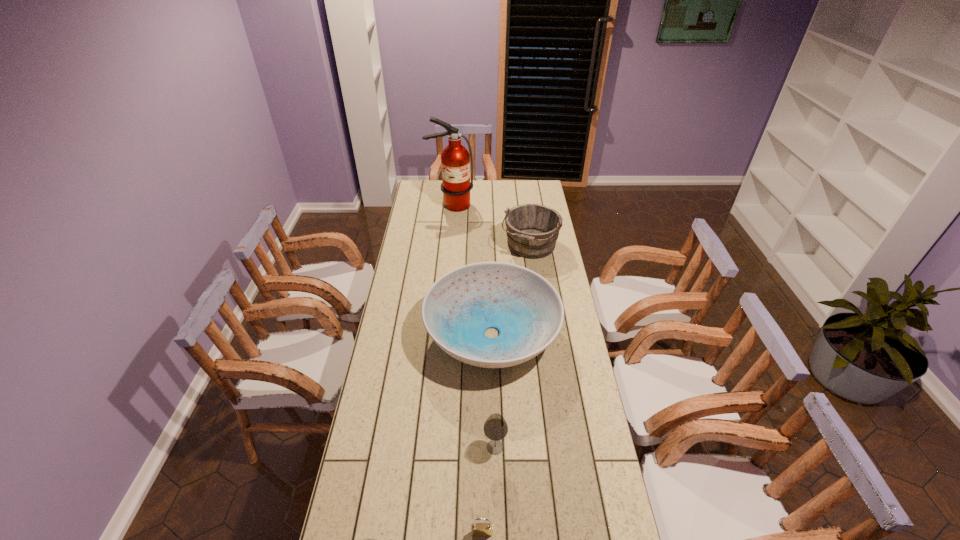
At what (x,y) coordinates should I click in order to perform the action: click on the farthest object. Please return your answer as a coordinate pair (x, y). Looking at the image, I should click on (455, 160).

This screenshot has width=960, height=540. Find the location of `the tallest object`. the tallest object is located at coordinates (455, 160).

Identify the location of the second farthest object. (532, 230).

You are a GUI agent. You are given a task and a screenshot of the screen. Output one action in this format:
    pyautogui.click(x=<x>, y=<y>)
    Task: Click on the dish
    The width and height of the screenshot is (960, 540).
    Given the screenshot: What is the action you would take?
    pyautogui.click(x=524, y=307)

I want to click on wineglass, so click(495, 428).

Where is `the second nearest object`? The width and height of the screenshot is (960, 540). the second nearest object is located at coordinates (477, 529).

Locate an element on the screen. The image size is (960, 540). the second shortest object is located at coordinates (477, 529).

I want to click on vacant space located 0.240m on the nozzle and handle of the farthest object, so click(x=447, y=238).

Identify the location of free space located 0.180m on the front of the fifth nearest object. (537, 291).

Where is `vacant area situated on the back of the dish`? The height and width of the screenshot is (540, 960). vacant area situated on the back of the dish is located at coordinates (490, 246).